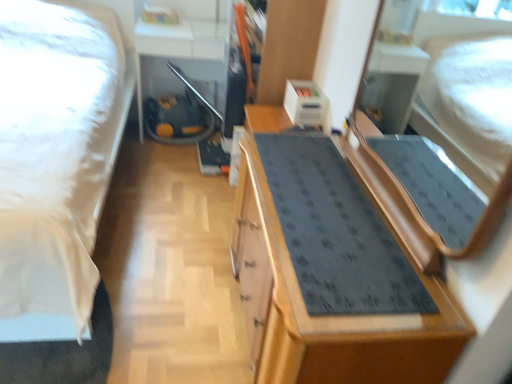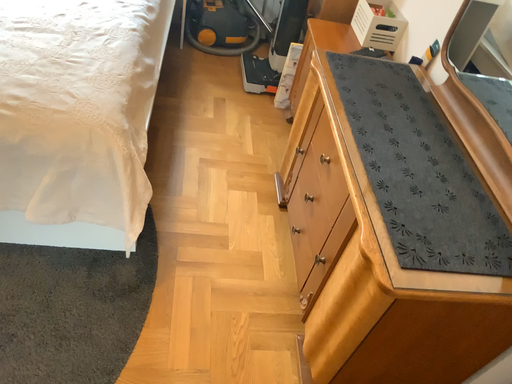
Question: Which way did the camera rotate in the video?

Choices:
 (A) rotated downward
 (B) rotated upward

Answer: (A)